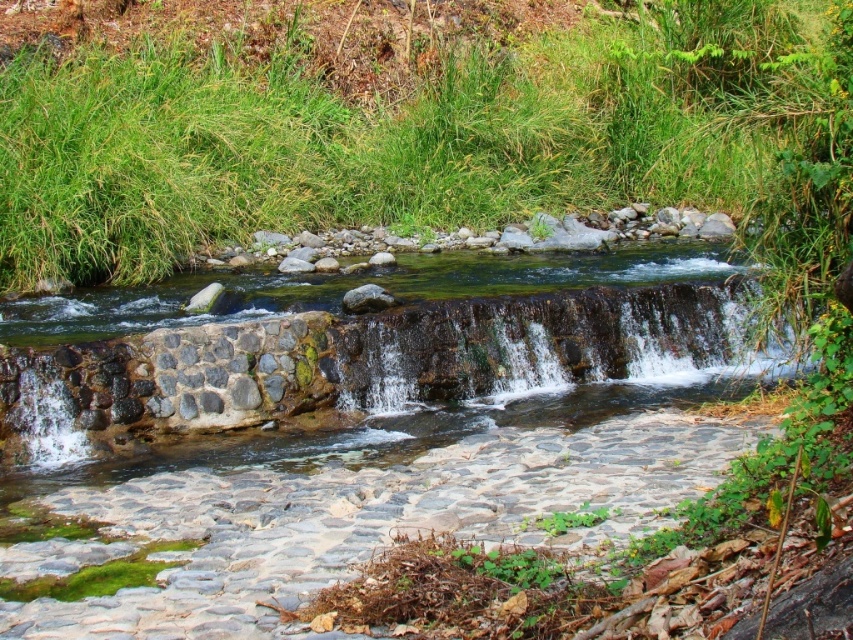
You are a landscape architect designing a garden and want to incorporate both the green grass at upper center and the dark brown stone waterfall at center. Based on their sizes, which one would you prioritize placing first in your design?

The green grass at upper center is bigger than the dark brown stone waterfall at center, so you should prioritize placing the green grass at upper center first in your design to accommodate its larger size.

You are a gardener who wants to plant a new flower bed. You have two options for locations in the scene described. The first is near the green grass at upper center, and the second is near the dark brown stone waterfall at center. Which location would provide more space for the flower bed due to the height of the existing vegetation?

The green grass at upper center is much taller than the dark brown stone waterfall at center, so the area near the dark brown stone waterfall at center would provide more space for the flower bed since the vegetation there is shorter.

You are standing at the edge of the stream and want to cross to the other side. There is a dark brown stone waterfall at center and green grass at upper center. Which object should you avoid stepping on to stay dry?

You should avoid stepping on the dark brown stone waterfall at center because the green grass at upper center is in front of it, meaning the waterfall is behind the grass and likely has flowing water, making it wet. The grass might be dryer ground to walk on.